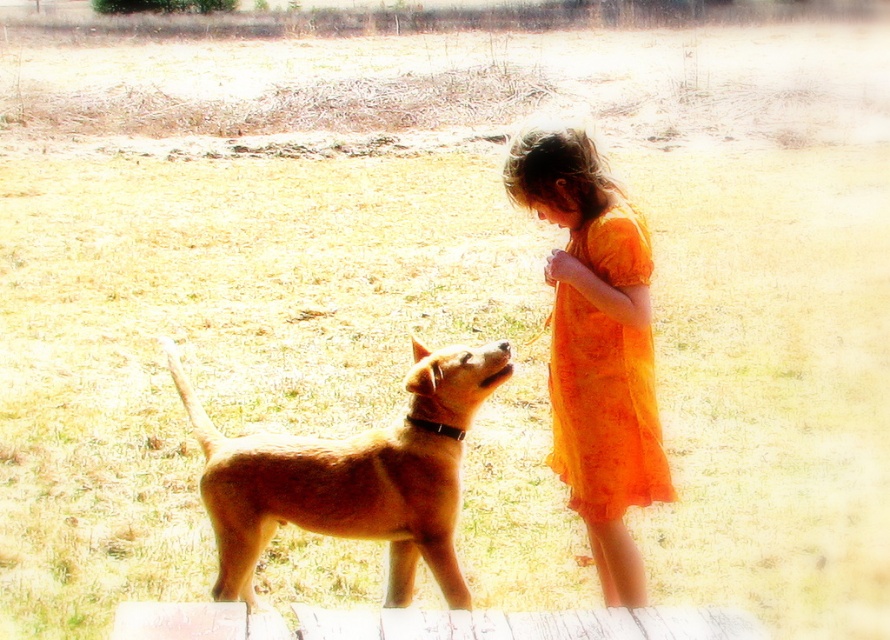
Question: Which point appears closest to the camera in this image?

Choices:
 (A) (662, 497)
 (B) (645, 305)
 (C) (277, 506)

Answer: (B)

Question: Which is nearer to the orange sheer dress at upper right?

Choices:
 (A) orange sheer dress at center
 (B) golden fur dog at center

Answer: (A)

Question: Which of the following is the closest to the observer?

Choices:
 (A) (330, 492)
 (B) (556, 253)

Answer: (B)

Question: Can you confirm if orange sheer dress at center is positioned to the left of orange sheer dress at upper right?

Choices:
 (A) yes
 (B) no

Answer: (A)

Question: Can you confirm if golden fur dog at center is wider than orange sheer dress at upper right?

Choices:
 (A) yes
 (B) no

Answer: (A)

Question: Does orange sheer dress at center have a larger size compared to orange sheer dress at upper right?

Choices:
 (A) yes
 (B) no

Answer: (A)